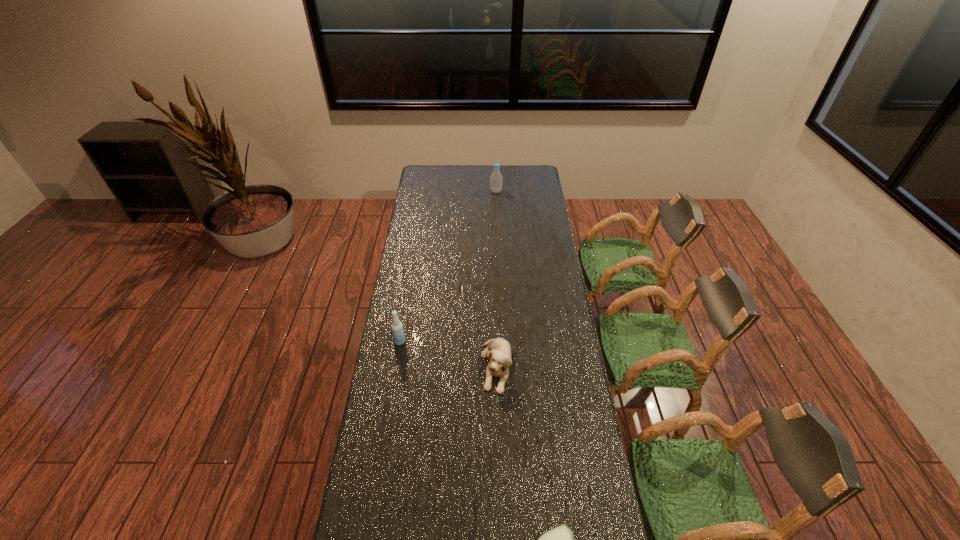
The height and width of the screenshot is (540, 960). Find the location of `vacant space that satisfies the following two spatial constraints: 1. on the back side of the leftmost object; 2. on the left side of the farthest bottle`. vacant space that satisfies the following two spatial constraints: 1. on the back side of the leftmost object; 2. on the left side of the farthest bottle is located at coordinates click(x=424, y=191).